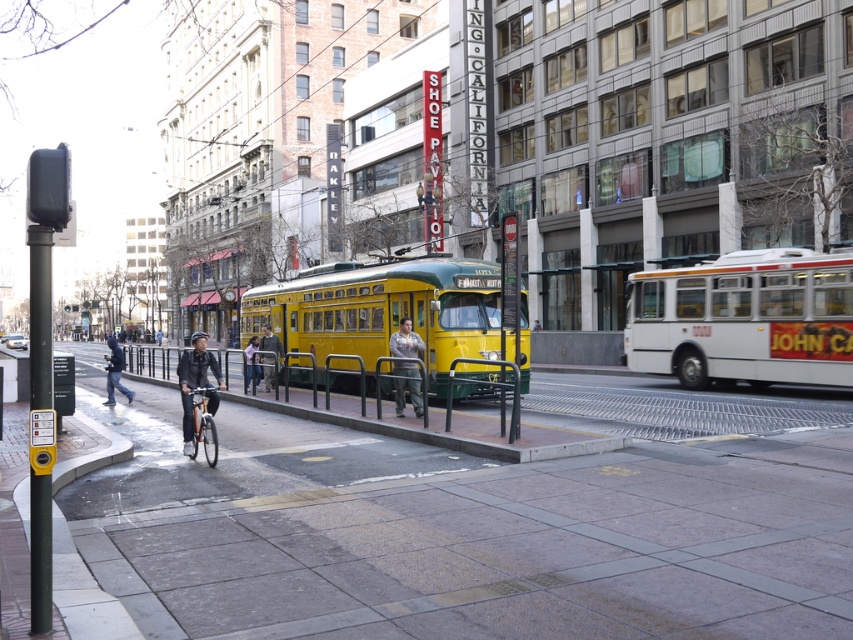
You are a pedestrian trying to cross the street and see a cyclist approaching. You notice the cyclist is wearing a dark blue jacket at center and camouflage pants at center. Which item of clothing is closer to you?

The dark blue jacket at center is closer to you because it is in front of the camouflage pants at center.

You are a delivery person trying to navigate through the crosswalk. There is an orange metallic bicycle at lower left blocking your path. Can you move around it to the right side without crossing the yellow tactile paving strip?

The orange metallic bicycle at lower left is located at point [196,384]. Since the yellow tactile paving strip is on the right side of the crosswalk, you can move around the bicycle to the right side while staying on the pavement tiles, avoiding the tactile strip.